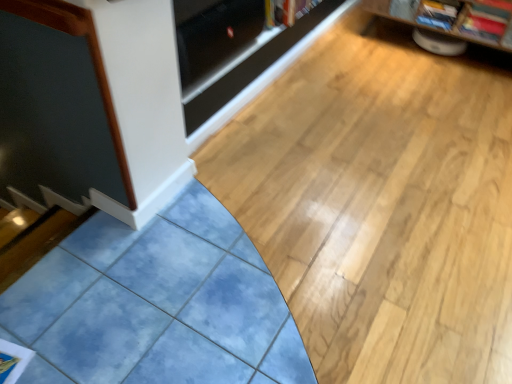
Describe the element at coordinates (438, 13) in the screenshot. The height and width of the screenshot is (384, 512). I see `matte plastic magazine at upper right, arranged as the 1th magazine when viewed from the left` at that location.

I want to click on transparent glass door at upper center, so click(214, 39).

What do you see at coordinates (426, 26) in the screenshot? The width and height of the screenshot is (512, 384). I see `wooden bookshelf at upper right` at bounding box center [426, 26].

In order to face hardcover book at upper center, should I rotate leftwards or rightwards?

Rotate right and turn 4.780 degrees.

This screenshot has width=512, height=384. I want to click on matte plastic magazine at upper right, arranged as the 1th magazine when viewed from the left, so (438, 13).

What's the angular difference between hardcover book at upper center and wooden bookshelf at upper right's facing directions?

The facing directions of hardcover book at upper center and wooden bookshelf at upper right are 89.9 degrees apart.

Is hardcover book at upper center oriented away from wooden bookshelf at upper right?

No.

Does hardcover book at upper center appear on the right side of wooden bookshelf at upper right?

Incorrect, hardcover book at upper center is not on the right side of wooden bookshelf at upper right.

Does hardcover book at upper center have a lesser width compared to wooden bookshelf at upper right?

Correct, the width of hardcover book at upper center is less than that of wooden bookshelf at upper right.

Between matte plastic magazine at upper right, marked as the second magazine in a right-to-left arrangement, and transparent glass door at upper center, which one has less height?

With less height is matte plastic magazine at upper right, marked as the second magazine in a right-to-left arrangement.

Is matte plastic magazine at upper right, arranged as the 1th magazine when viewed from the left, located outside transparent glass door at upper center?

Yes, matte plastic magazine at upper right, arranged as the 1th magazine when viewed from the left, is outside of transparent glass door at upper center.

Can you confirm if matte plastic magazine at upper right, arranged as the 1th magazine when viewed from the left, is smaller than transparent glass door at upper center?

Indeed, matte plastic magazine at upper right, arranged as the 1th magazine when viewed from the left, has a smaller size compared to transparent glass door at upper center.

Is matte plastic magazine at upper right, marked as the second magazine in a right-to-left arrangement, aimed at transparent glass door at upper center?

No, matte plastic magazine at upper right, marked as the second magazine in a right-to-left arrangement, is not aimed at transparent glass door at upper center.

Does point (498, 23) come behind point (421, 9)?

No, (498, 23) is in front of (421, 9).

Is red glossy magazine at upper right, acting as the first magazine starting from the right, facing away from matte plastic magazine at upper right, arranged as the 1th magazine when viewed from the left?

That's not correct — red glossy magazine at upper right, acting as the first magazine starting from the right, is not looking away from matte plastic magazine at upper right, arranged as the 1th magazine when viewed from the left.

Is red glossy magazine at upper right, arranged as the 2th magazine when viewed from the left, outside of matte plastic magazine at upper right, arranged as the 1th magazine when viewed from the left?

That's correct, red glossy magazine at upper right, arranged as the 2th magazine when viewed from the left, is outside of matte plastic magazine at upper right, arranged as the 1th magazine when viewed from the left.

Does red glossy magazine at upper right, arranged as the 2th magazine when viewed from the left, have a lesser height compared to matte plastic magazine at upper right, arranged as the 1th magazine when viewed from the left?

Yes, red glossy magazine at upper right, arranged as the 2th magazine when viewed from the left, is shorter than matte plastic magazine at upper right, arranged as the 1th magazine when viewed from the left.

Is matte plastic magazine at upper right, arranged as the 1th magazine when viewed from the left, next to wooden bookshelf at upper right?

No, matte plastic magazine at upper right, arranged as the 1th magazine when viewed from the left, is not next to wooden bookshelf at upper right.

Is matte plastic magazine at upper right, marked as the second magazine in a right-to-left arrangement, turned away from wooden bookshelf at upper right?

Correct, matte plastic magazine at upper right, marked as the second magazine in a right-to-left arrangement, is looking away from wooden bookshelf at upper right.

Is point (444, 15) less distant than point (451, 31)?

Yes.

Is matte plastic magazine at upper right, arranged as the 1th magazine when viewed from the left, taller or shorter than wooden bookshelf at upper right?

Considering their sizes, matte plastic magazine at upper right, arranged as the 1th magazine when viewed from the left, has less height than wooden bookshelf at upper right.

Considering the sizes of objects wooden bookshelf at upper right and red glossy magazine at upper right, arranged as the 2th magazine when viewed from the left, in the image provided, who is bigger, wooden bookshelf at upper right or red glossy magazine at upper right, arranged as the 2th magazine when viewed from the left,?

wooden bookshelf at upper right is bigger.

Considering the positions of point (417, 24) and point (474, 0), is point (417, 24) closer or farther from the camera than point (474, 0)?

Point (417, 24) is positioned farther from the camera compared to point (474, 0).

Is wooden bookshelf at upper right facing away from red glossy magazine at upper right, acting as the first magazine starting from the right?

Yes, wooden bookshelf at upper right is facing away from red glossy magazine at upper right, acting as the first magazine starting from the right.

Is wooden bookshelf at upper right directly adjacent to red glossy magazine at upper right, acting as the first magazine starting from the right?

No, wooden bookshelf at upper right is not in contact with red glossy magazine at upper right, acting as the first magazine starting from the right.

Is transparent glass door at upper center next to matte plastic magazine at upper right, marked as the second magazine in a right-to-left arrangement?

transparent glass door at upper center is not next to matte plastic magazine at upper right, marked as the second magazine in a right-to-left arrangement, and they're not touching.

Is transparent glass door at upper center to the right of matte plastic magazine at upper right, arranged as the 1th magazine when viewed from the left, from the viewer's perspective?

In fact, transparent glass door at upper center is to the left of matte plastic magazine at upper right, arranged as the 1th magazine when viewed from the left.

Starting from the transparent glass door at upper center, which magazine is the 2nd one behind? Please provide its 2D coordinates.

[(438, 13)]

Does point (209, 86) lie in front of point (444, 4)?

Yes, it is in front of point (444, 4).

From a real-world perspective, is red glossy magazine at upper right, arranged as the 2th magazine when viewed from the left, below hardcover book at upper center?

Yes, from a real-world perspective, red glossy magazine at upper right, arranged as the 2th magazine when viewed from the left, is under hardcover book at upper center.

The image size is (512, 384). There is a red glossy magazine at upper right, arranged as the 2th magazine when viewed from the left. In order to click on book above it (from a real-world perspective) in this screenshot , I will do `click(286, 11)`.

Considering their positions, is red glossy magazine at upper right, arranged as the 2th magazine when viewed from the left, located in front of or behind hardcover book at upper center?

Clearly, red glossy magazine at upper right, arranged as the 2th magazine when viewed from the left, is behind hardcover book at upper center.

Considering the positions of points (501, 18) and (270, 14), is point (501, 18) farther from camera compared to point (270, 14)?

Yes, it is behind point (270, 14).

This screenshot has width=512, height=384. I want to click on shelf beneath the hardcover book at upper center (from a real-world perspective), so click(426, 26).

Which magazine is the 2nd one when counting from the back of the transparent glass door at upper center? Please provide its 2D coordinates.

[(438, 13)]

Based on the photo, estimate the real-world distances between objects in this image. Which object is further from red glossy magazine at upper right, arranged as the 2th magazine when viewed from the left, wooden bookshelf at upper right or hardcover book at upper center?

hardcover book at upper center.

Considering their positions, is wooden bookshelf at upper right positioned further to transparent glass door at upper center than red glossy magazine at upper right, acting as the first magazine starting from the right?

Based on the image, wooden bookshelf at upper right appears to be further to transparent glass door at upper center.

From the image, which object appears to be nearer to matte plastic magazine at upper right, arranged as the 1th magazine when viewed from the left, red glossy magazine at upper right, arranged as the 2th magazine when viewed from the left, or transparent glass door at upper center?

red glossy magazine at upper right, arranged as the 2th magazine when viewed from the left.

Which object lies further to the anchor point matte plastic magazine at upper right, marked as the second magazine in a right-to-left arrangement, wooden bookshelf at upper right or red glossy magazine at upper right, acting as the first magazine starting from the right?

wooden bookshelf at upper right is further to matte plastic magazine at upper right, marked as the second magazine in a right-to-left arrangement.

Looking at the image, which one is located further to red glossy magazine at upper right, arranged as the 2th magazine when viewed from the left, matte plastic magazine at upper right, arranged as the 1th magazine when viewed from the left, or hardcover book at upper center?

hardcover book at upper center is further to red glossy magazine at upper right, arranged as the 2th magazine when viewed from the left.

When comparing their distances from matte plastic magazine at upper right, arranged as the 1th magazine when viewed from the left, does hardcover book at upper center or red glossy magazine at upper right, arranged as the 2th magazine when viewed from the left, seem closer?

Answer: red glossy magazine at upper right, arranged as the 2th magazine when viewed from the left, is positioned closer to the anchor matte plastic magazine at upper right, arranged as the 1th magazine when viewed from the left.

Based on their spatial positions, is red glossy magazine at upper right, arranged as the 2th magazine when viewed from the left, or transparent glass door at upper center further from hardcover book at upper center?

red glossy magazine at upper right, arranged as the 2th magazine when viewed from the left, is further to hardcover book at upper center.

Estimate the real-world distances between objects in this image. Which object is further from transparent glass door at upper center, hardcover book at upper center or matte plastic magazine at upper right, marked as the second magazine in a right-to-left arrangement?

matte plastic magazine at upper right, marked as the second magazine in a right-to-left arrangement, is positioned further to the anchor transparent glass door at upper center.

I want to click on book situated between transparent glass door at upper center and red glossy magazine at upper right, acting as the first magazine starting from the right, from left to right, so click(x=286, y=11).

Where is `magazine between hardcover book at upper center and red glossy magazine at upper right, arranged as the 2th magazine when viewed from the left, from left to right`? magazine between hardcover book at upper center and red glossy magazine at upper right, arranged as the 2th magazine when viewed from the left, from left to right is located at coordinates pyautogui.click(x=438, y=13).

Where is `magazine between hardcover book at upper center and wooden bookshelf at upper right`? The height and width of the screenshot is (384, 512). magazine between hardcover book at upper center and wooden bookshelf at upper right is located at coordinates pyautogui.click(x=438, y=13).

Where is `book between transparent glass door at upper center and wooden bookshelf at upper right from left to right`? book between transparent glass door at upper center and wooden bookshelf at upper right from left to right is located at coordinates (286, 11).